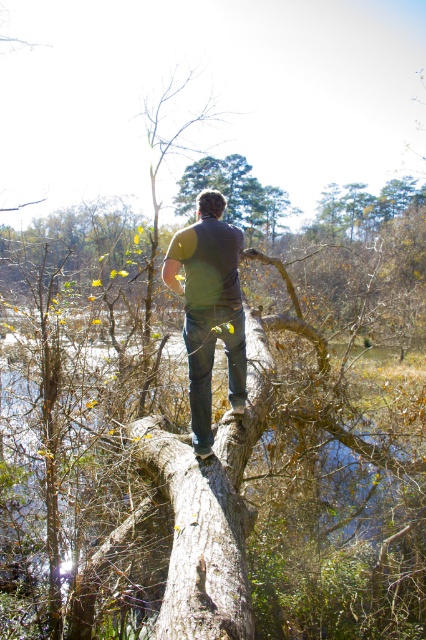
Looking at this image, you are a hiker who wants to cross the smooth brown log at center. You are currently standing next to the dark gray shirt at center. Can you step onto the log from your current position?

The smooth brown log at center and dark gray shirt at center are 33.81 inches apart. Since the distance between them is about 33.81 inches, which is roughly 2.8 feet, it might be challenging to step onto the log from the current position unless you can jump that distance. However, safety should be considered before attempting such a move.

You are standing in the scene and want to place a small marker at the closest point to you between the two points labeled as point (x=181, y=579) and point (x=184, y=257). Which point should you choose?

Point (x=181, y=579) is closer to the viewer than point (x=184, y=257), so you should choose point (x=181, y=579).

You are a hiker who wants to cross the smooth brown log at center without getting your shoes dirty. The dark gray shirt at center is in your way. Can you move around the log on its right side to avoid the shirt?

The smooth brown log at center is positioned on the left side of dark gray shirt at center, so the shirt is to the right of the log. Therefore, moving to the right side of the log would take you away from the shirt, allowing you to cross without getting dirty.